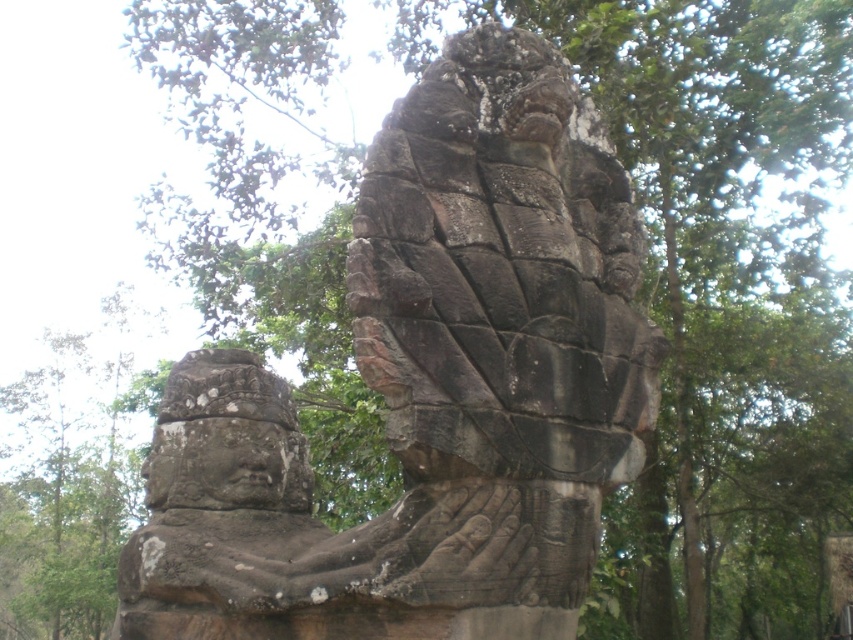
Question: Which point is closer to the camera taking this photo?

Choices:
 (A) 526,550
 (B) 221,474

Answer: (A)

Question: Is rough stone sculpture at center closer to camera compared to rough stone face at center?

Choices:
 (A) no
 (B) yes

Answer: (B)

Question: Considering the relative positions of rough stone sculpture at center and rough stone face at center in the image provided, where is rough stone sculpture at center located with respect to rough stone face at center?

Choices:
 (A) right
 (B) left

Answer: (A)

Question: Is rough stone sculpture at center to the right of rough stone face at center from the viewer's perspective?

Choices:
 (A) no
 (B) yes

Answer: (B)